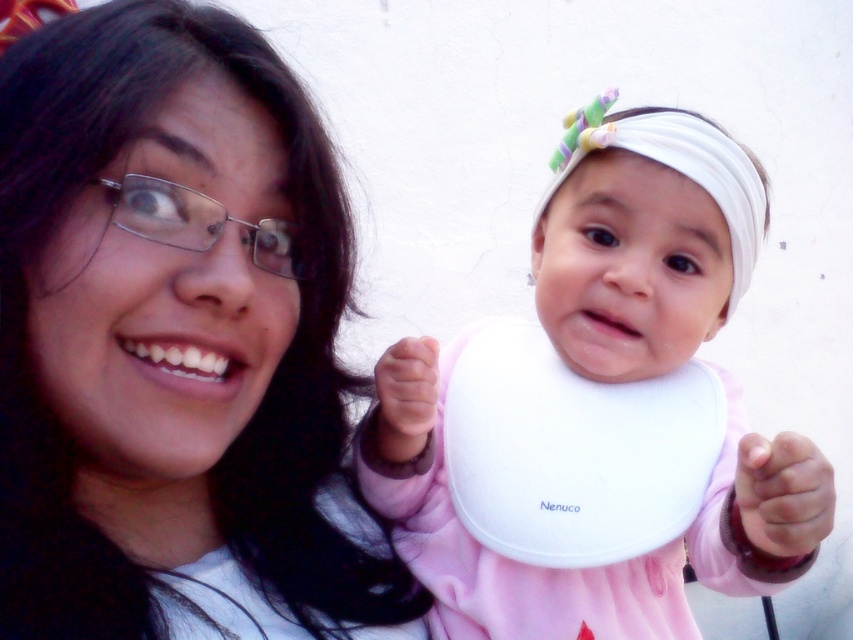
Question: Which point is closer to the camera?

Choices:
 (A) (497, 621)
 (B) (323, 202)

Answer: (B)

Question: Is white fabric headscarf at upper right bigger than pink fabric hand at lower right?

Choices:
 (A) no
 (B) yes

Answer: (B)

Question: Which object is the farthest from the matte white shirt at upper left?

Choices:
 (A) white fabric bib at center
 (B) white fabric headscarf at upper right
 (C) pink fabric hand at lower right
 (D) pink fabric hand at center

Answer: (C)

Question: Which object is the farthest from the pink fabric hand at center?

Choices:
 (A) white fabric headscarf at upper right
 (B) white fabric bib at center
 (C) pink fabric hand at lower right

Answer: (C)

Question: Is white fabric bib at center positioned behind white fabric headscarf at upper right?

Choices:
 (A) yes
 (B) no

Answer: (B)

Question: Is white fabric headscarf at upper right smaller than pink fabric hand at lower right?

Choices:
 (A) yes
 (B) no

Answer: (B)